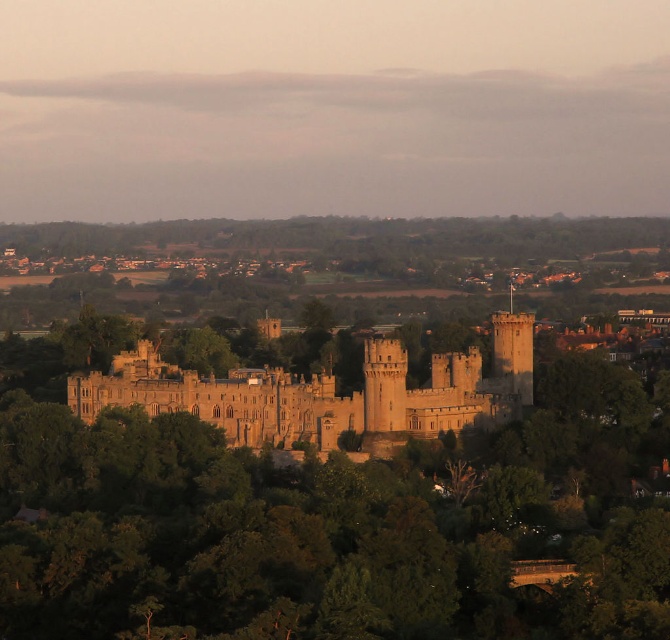
Question: Which of the following is the farthest from the observer?

Choices:
 (A) golden stone castle at center
 (B) green leafy tree at center

Answer: (A)

Question: Where is green leafy tree at center located in relation to golden stone castle at center in the image?

Choices:
 (A) below
 (B) above

Answer: (A)

Question: Does green leafy tree at center appear under golden stone castle at center?

Choices:
 (A) yes
 (B) no

Answer: (A)

Question: Is green leafy tree at center below golden stone castle at center?

Choices:
 (A) yes
 (B) no

Answer: (A)

Question: Which point is farther to the camera?

Choices:
 (A) (212, 401)
 (B) (517, 364)

Answer: (B)